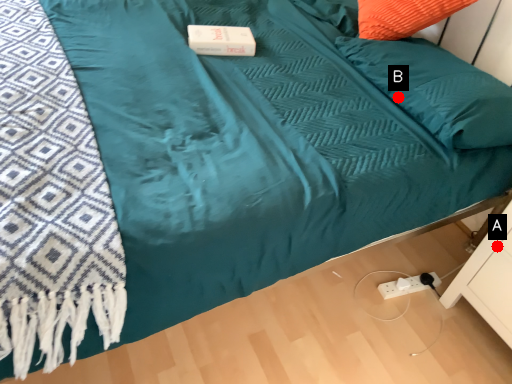
Question: Two points are circled on the image, labeled by A and B beside each circle. Which point is closer to the camera?

Choices:
 (A) A is closer
 (B) B is closer

Answer: (A)